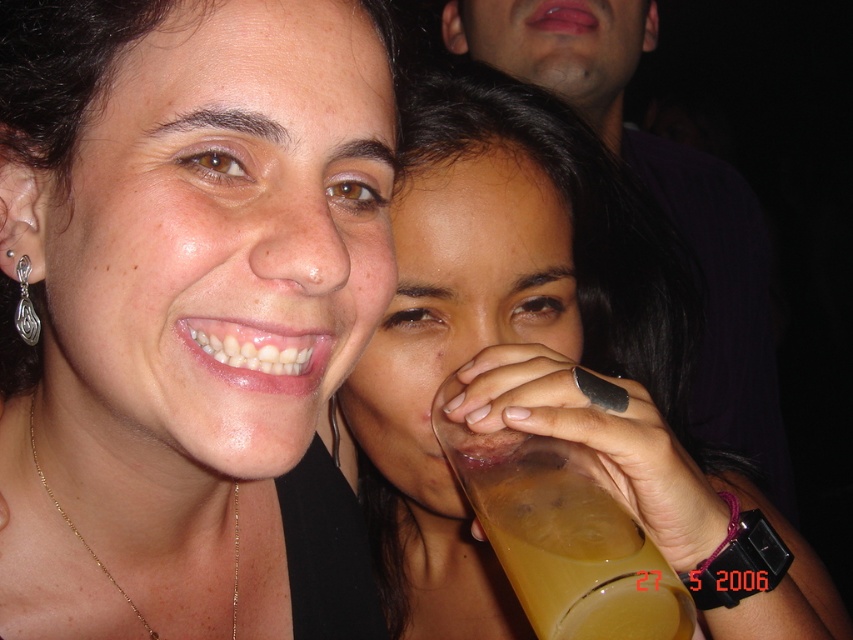
Question: Which point is farther to the camera?

Choices:
 (A) (82, 538)
 (B) (544, 289)

Answer: (B)

Question: Can you confirm if translucent plastic cup at center is positioned below gold chain at lower center?

Choices:
 (A) yes
 (B) no

Answer: (B)

Question: Which point appears farthest from the camera in this image?

Choices:
 (A) (105, 573)
 (B) (653, 589)

Answer: (A)

Question: Is matte black necklace at center above translucent yellow liquid at hand right?

Choices:
 (A) yes
 (B) no

Answer: (A)

Question: Can you confirm if matte black necklace at center is bigger than translucent yellow liquid at hand right?

Choices:
 (A) no
 (B) yes

Answer: (B)

Question: Which object is closer to the camera taking this photo?

Choices:
 (A) translucent plastic cup at center
 (B) matte black necklace at center
 (C) translucent yellow liquid at hand right
 (D) gold chain at lower center

Answer: (B)